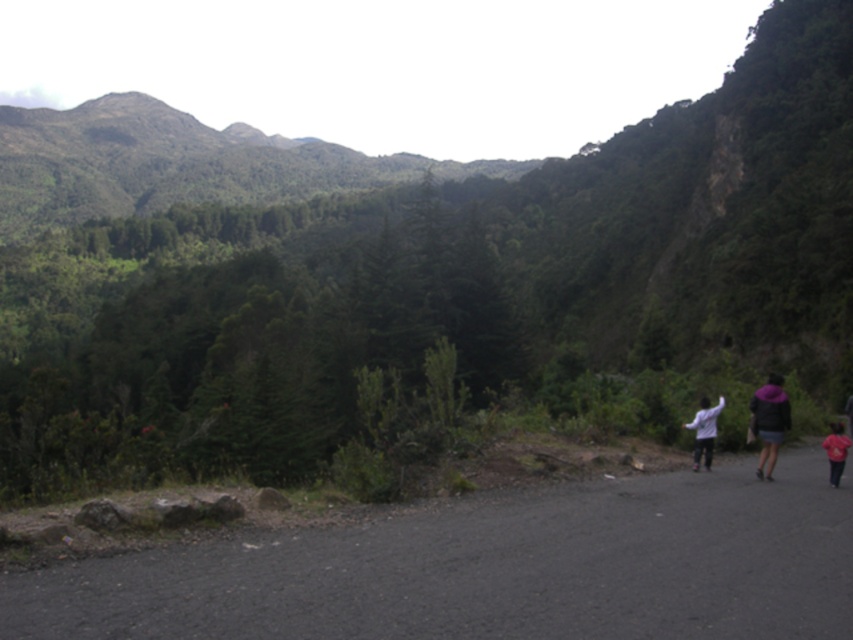
Question: Estimate the real-world distances between objects in this image. Which object is closer to the white cotton shirt at right?

Choices:
 (A) white matte jacket at center-right
 (B) black asphalt road at center

Answer: (A)

Question: Which point is farther from the camera taking this photo?

Choices:
 (A) (781, 432)
 (B) (851, 412)
 (C) (267, 593)

Answer: (B)

Question: Is white matte jacket at center-right in front of white cotton shirt at right?

Choices:
 (A) no
 (B) yes

Answer: (B)

Question: Among these points, which one is nearest to the camera?

Choices:
 (A) (828, 461)
 (B) (749, 506)
 (C) (846, 410)

Answer: (B)

Question: Is purple fuzzy jacket at right wider than white cotton shirt at right?

Choices:
 (A) no
 (B) yes

Answer: (B)

Question: In this image, where is white matte jacket at center-right located relative to white cotton shirt at right?

Choices:
 (A) below
 (B) above

Answer: (B)